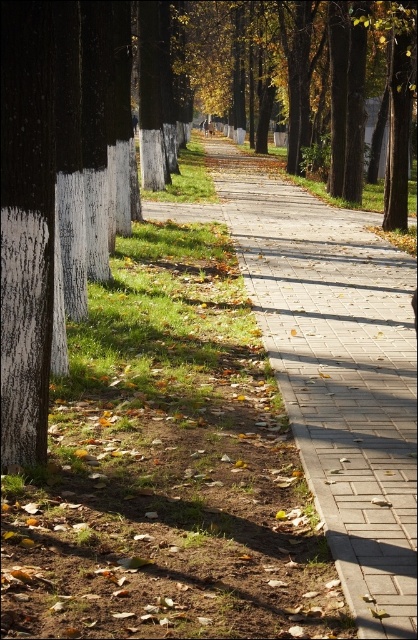
You are standing on the paved concrete path at center and want to reach the black bark tree at center. Which direction should you move to get closer to the tree?

Since the paved concrete path at center is closer to the viewer than the black bark tree at center, you should move forward along the path towards the tree to get closer.

Based on the photo, you are standing on the paved concrete path at center and want to walk towards the direction where the shadows are pointing. Which direction should you walk relative to the black bark tree at center?

Since the paved concrete path at center is to the right of the black bark tree at center, and the shadows point towards the right side of the image, you should walk towards the right relative to the black bark tree at center to follow the direction of the shadows.

You are standing at the entrance of the park and want to reach the paved concrete path at center. According to the scene description, where should you walk to find it?

The paved concrete path at center is located at point (336, 372), so you should walk towards that coordinate to reach it.